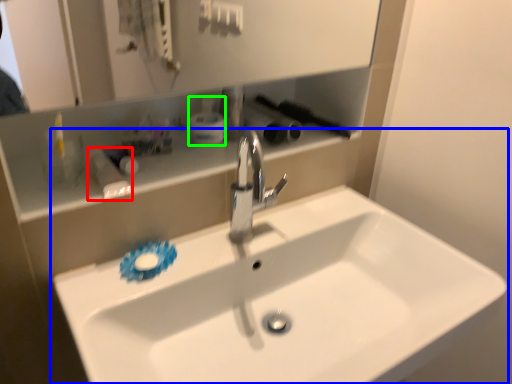
Question: Which object is the farthest from toiletry (highlighted by a red box)? Choose among these: sink (highlighted by a blue box) or toiletry (highlighted by a green box).

Choices:
 (A) sink
 (B) toiletry

Answer: (A)